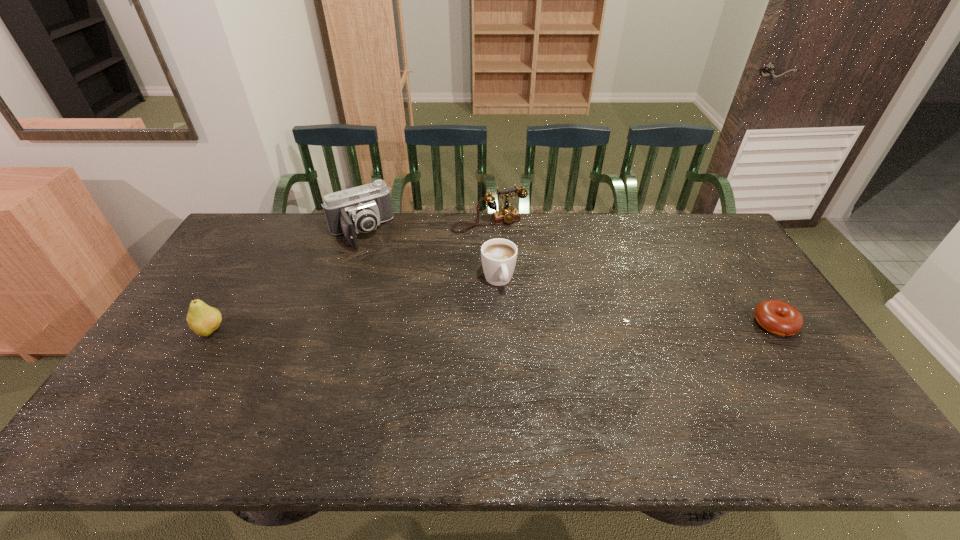
The width and height of the screenshot is (960, 540). Find the location of `free space between the camera and the rightmost object`. free space between the camera and the rightmost object is located at coordinates (567, 278).

The height and width of the screenshot is (540, 960). Find the location of `free space between the telephone and the pear`. free space between the telephone and the pear is located at coordinates (349, 277).

This screenshot has height=540, width=960. In order to click on free spot between the camera and the doughnut in this screenshot , I will do `click(567, 278)`.

Image resolution: width=960 pixels, height=540 pixels. In order to click on free space between the second object from left to right and the doughnut in this screenshot , I will do `click(567, 278)`.

Locate an element on the screen. vacant area that lies between the telephone and the leftmost object is located at coordinates (349, 277).

Where is `free spot between the doughnut and the third farthest object`? free spot between the doughnut and the third farthest object is located at coordinates (636, 302).

Find the location of `vacant area between the fourth tallest object and the second object from left to right`. vacant area between the fourth tallest object and the second object from left to right is located at coordinates (429, 256).

Select which object is the closest to the telephone. Please provide its 2D coordinates. Your answer should be formatted as a tuple, i.e. [(x, y)], where the tuple contains the x and y coordinates of a point satisfying the conditions above.

[(498, 256)]

Locate an element on the screen. This screenshot has width=960, height=540. object that is the fourth closest one to the telephone is located at coordinates (203, 319).

Find the location of a particular element. free space in the image that satisfies the following two spatial constraints: 1. on the back side of the leftmost object; 2. on the left side of the second object from left to right is located at coordinates (269, 233).